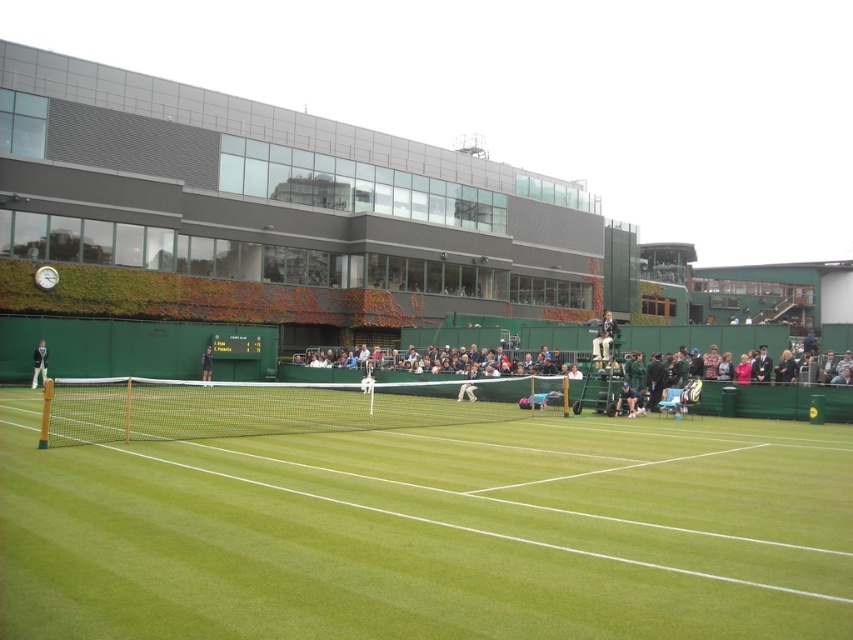
You are a drone operator tasked with capturing aerial footage of the green grass tennis court at center. The camera is currently positioned at point A, which is at coordinates 0.831, 0.506. To ensure the entire court is visible in the shot, should you adjust the camera position to the left or right? Please explain your reasoning based on the court location.

The green grass tennis court at center is located at point (431, 531). Since the camera is already positioned at this exact point, no adjustment to the left or right is necessary. The camera is centered over the court, ensuring the entire court is visible in the shot.

You are a tennis ball that just got hit by the opponent. You are currently flying towards the white fabric tennis player at center. Where should you land to avoid hitting them?

To avoid hitting the white fabric tennis player at center, you should land either to the left or right side of them, as they are positioned at the center point.